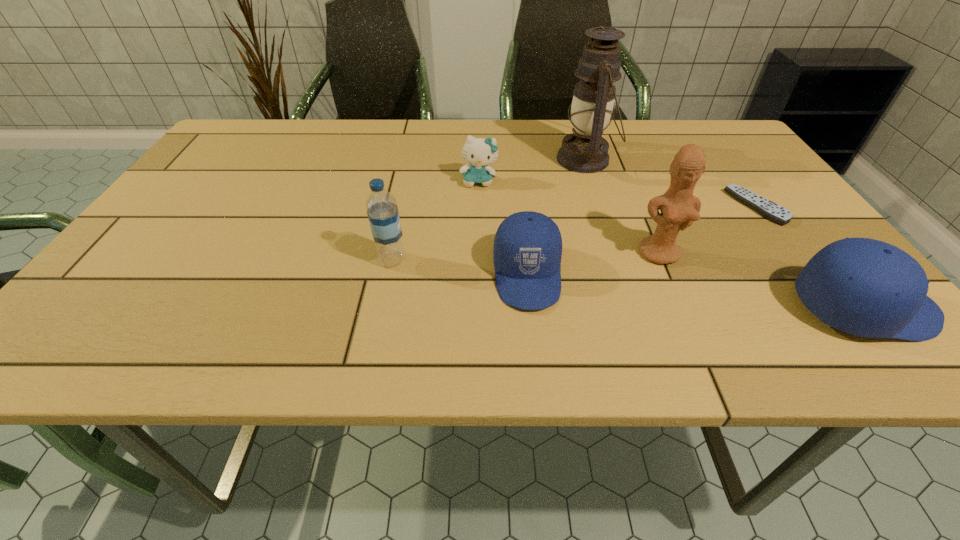
Identify the location of the shorter cap. (527, 251).

At what (x,y) coordinates should I click in order to perform the action: click on the tallest object. Please return your answer as a coordinate pair (x, y). This screenshot has height=540, width=960. Looking at the image, I should click on (585, 151).

Find the location of a particular element. The height and width of the screenshot is (540, 960). remote control is located at coordinates (768, 209).

Where is `kitten`? This screenshot has height=540, width=960. kitten is located at coordinates (478, 152).

Identify the location of the leftmost object. The image size is (960, 540). (382, 210).

Locate an element on the screen. This screenshot has width=960, height=540. the third tallest object is located at coordinates (382, 210).

Identify the location of figurine. This screenshot has height=540, width=960. (679, 208).

Where is `free spot located on the front of the tallest object`? The image size is (960, 540). free spot located on the front of the tallest object is located at coordinates (632, 300).

Find the location of a particular element. vacant space located 0.080m on the left of the shortest object is located at coordinates (699, 207).

Where is `vacant space positioned 0.080m on the face of the kitten`? The width and height of the screenshot is (960, 540). vacant space positioned 0.080m on the face of the kitten is located at coordinates (479, 210).